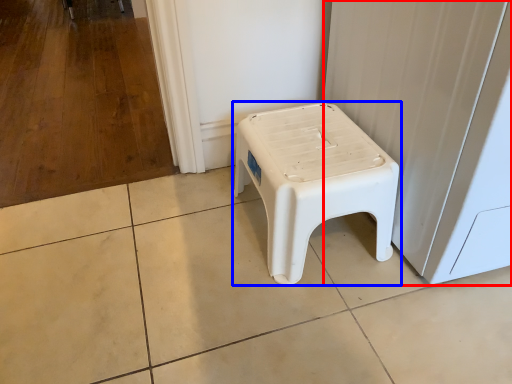
Question: Which object appears closest to the camera in this image, screen door (highlighted by a red box) or stool (highlighted by a blue box)?

Choices:
 (A) screen door
 (B) stool

Answer: (A)